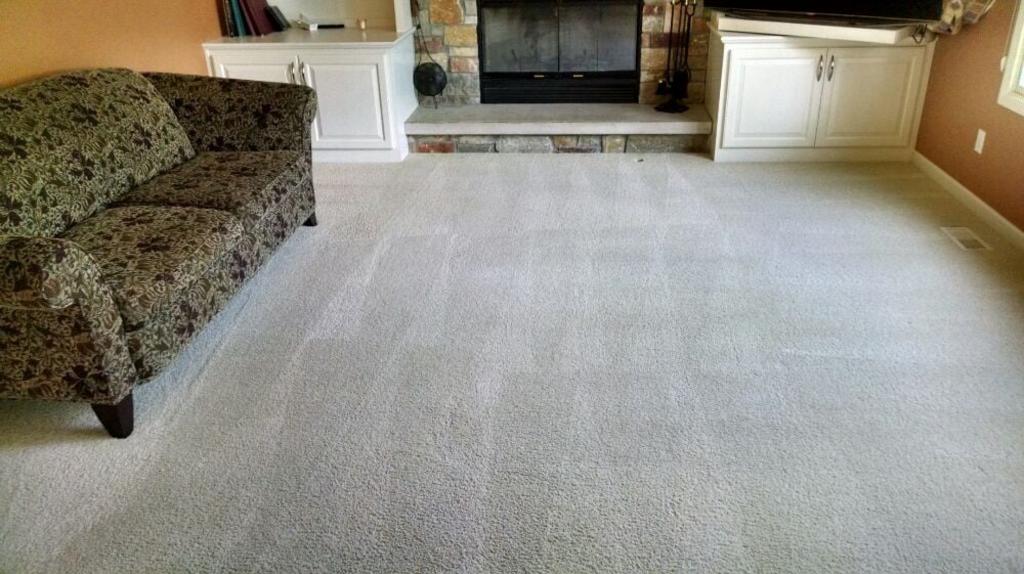
The width and height of the screenshot is (1024, 574). Identify the location of window frame. (1015, 96).